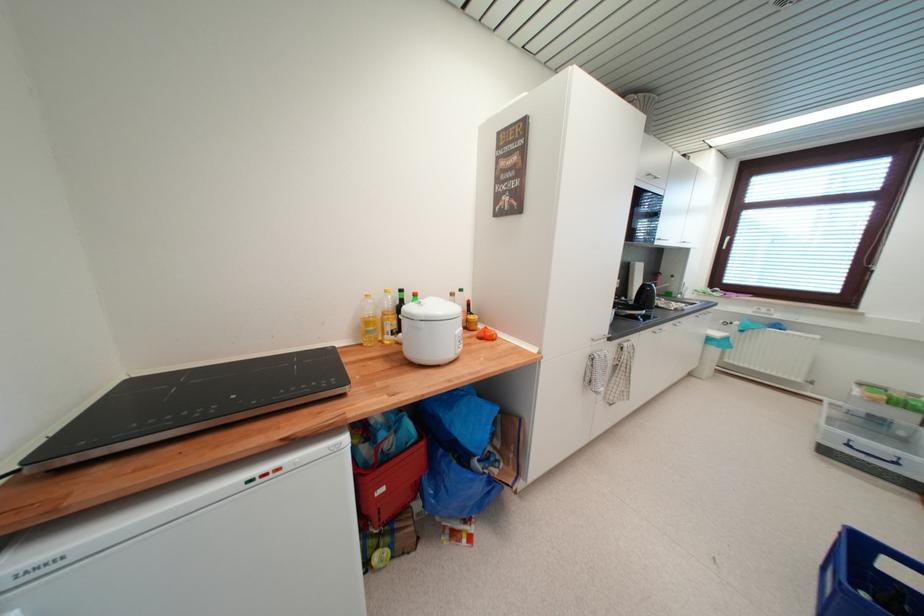
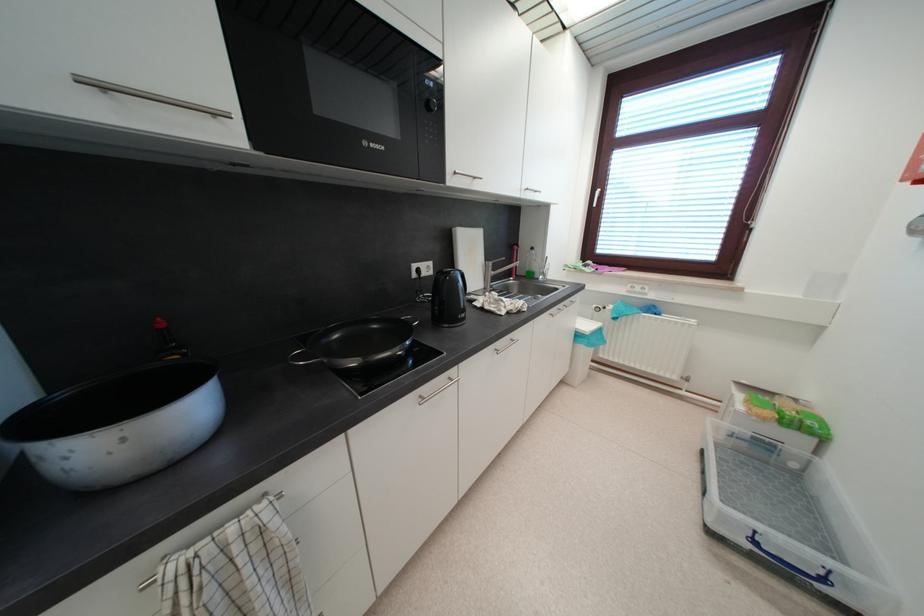
Which direction would the cameraman need to move to produce the second image?

The movement direction of the cameraman is right, forward.